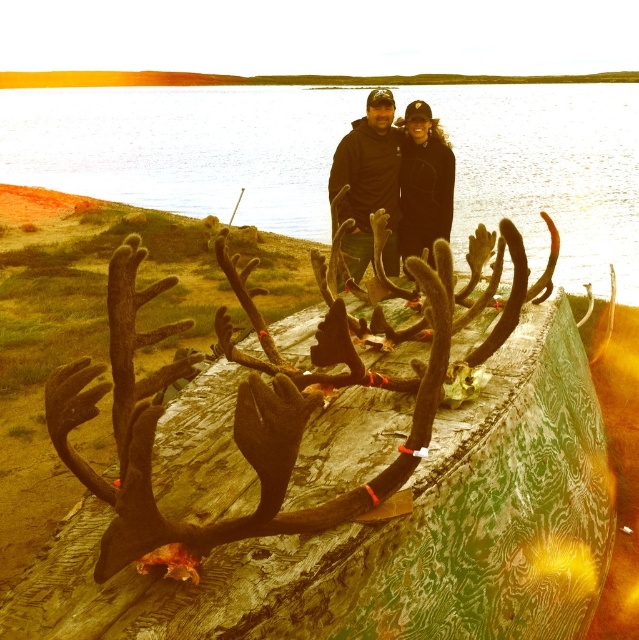
You are a photographer planning to take a sunset shot of the scene. You want to ensure that both the greenish water at upper center and the black fleece jacket at center are clearly visible in your photo. Based on their positions, which object should you focus on first to ensure both are in focus?

Since the greenish water at upper center is located above the black fleece jacket at center, you should focus on the black fleece jacket at center first, as it is closer to the camera. This will ensure that both objects remain in focus due to the depth of field extending from the jacket to the water above.

You are a photographer trying to capture the sunset reflection on the water. You are standing near the greenish water at upper center and the black fleece jacket at center. Which object is closer to you, the photographer?

The greenish water at upper center is closer to you than the black fleece jacket at center because it is further to the viewer.